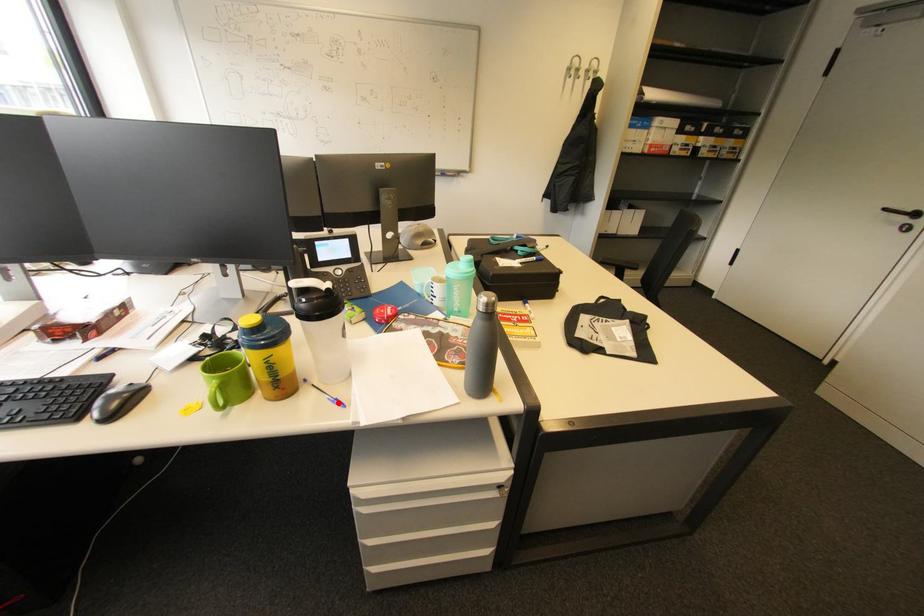
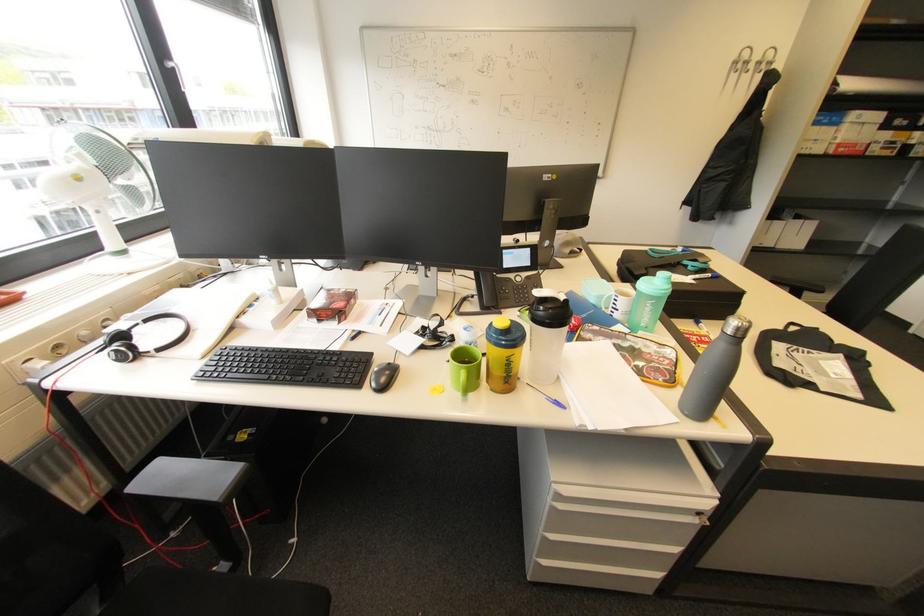
Where in the second image is the point corresponding to the highlighted location from the first image?

(558, 403)